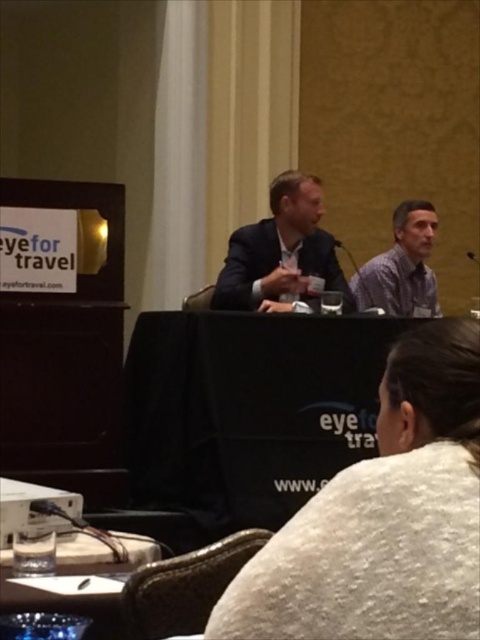
Question: Which point appears farthest from the camera in this image?

Choices:
 (A) (410, 234)
 (B) (330, 276)
 (C) (424, 628)

Answer: (A)

Question: Does matte black suit at center appear under gray fabric shirt at right?

Choices:
 (A) no
 (B) yes

Answer: (B)

Question: Among these objects, which one is nearest to the camera?

Choices:
 (A) white fuzzy sweater at lower center
 (B) gray fabric shirt at right
 (C) matte black suit at center

Answer: (A)

Question: Is white fuzzy sweater at lower center further to camera compared to matte black suit at center?

Choices:
 (A) yes
 (B) no

Answer: (B)

Question: Among these points, which one is farthest from the camera?

Choices:
 (A) (317, 582)
 (B) (425, 234)
 (C) (288, 266)

Answer: (B)

Question: Does matte black suit at center appear over gray fabric shirt at right?

Choices:
 (A) no
 (B) yes

Answer: (A)